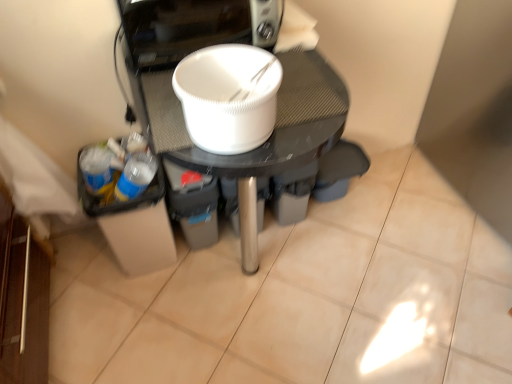
Identify the location of free space in front of white matte bowl at center. (253, 355).